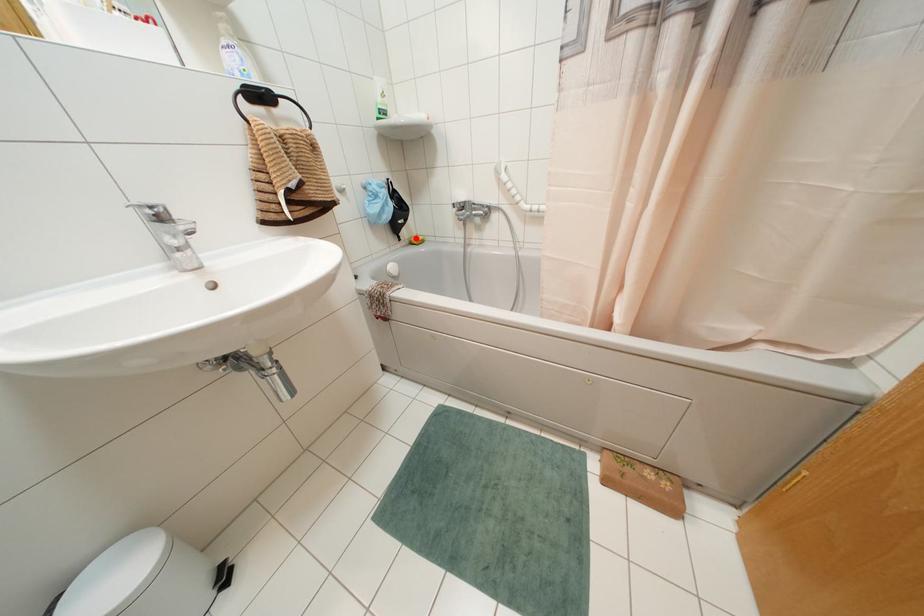
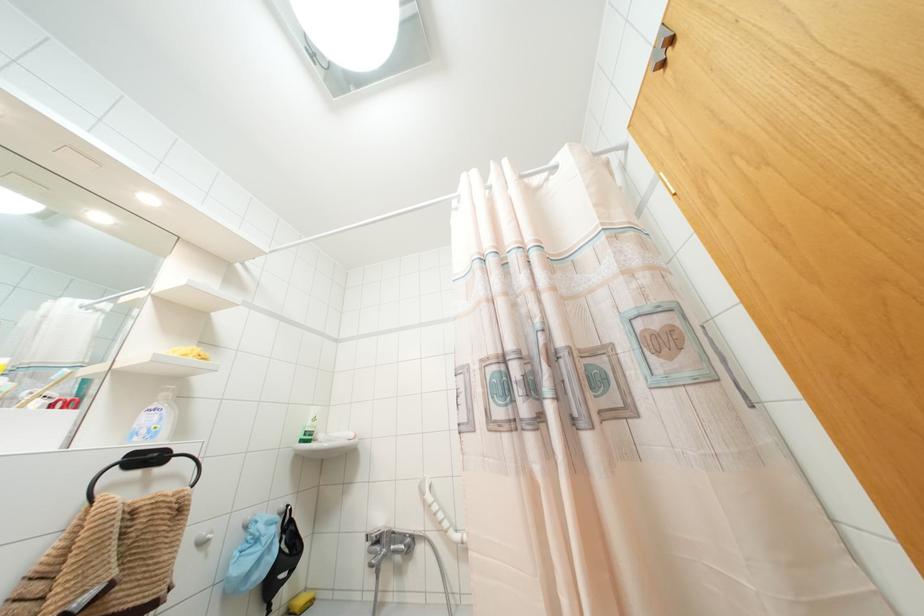
Find the pixel in the second image that matches the highlighted location in the first image.

(299, 601)